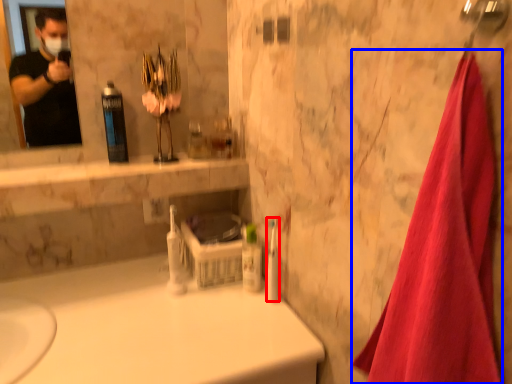
Question: Among these objects, which one is nearest to the camera, toiletry (highlighted by a red box) or bath towel (highlighted by a blue box)?

Choices:
 (A) toiletry
 (B) bath towel

Answer: (B)